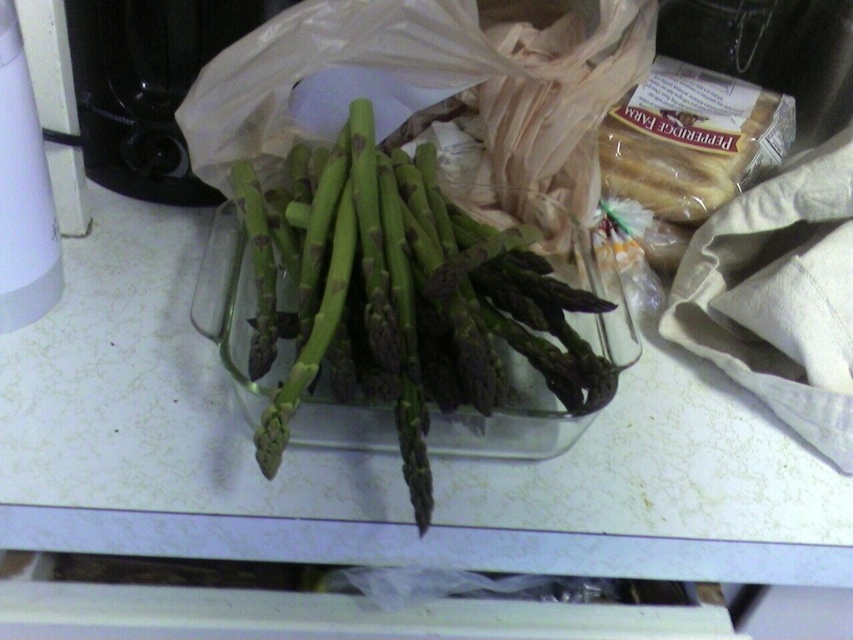
Where is the green glossy asparagus at center located in the image?

The green glossy asparagus at center is located at point [401,298] in the image.

You are organizing the kitchen and want to place both the black plastic toaster at upper left and the white plastic kettle at left on a shelf that can only hold one large item. Which item should you place there first?

The black plastic toaster at upper left is larger in size than the white plastic kettle at left, so you should place the black plastic toaster at upper left first to ensure it fits on the shelf.